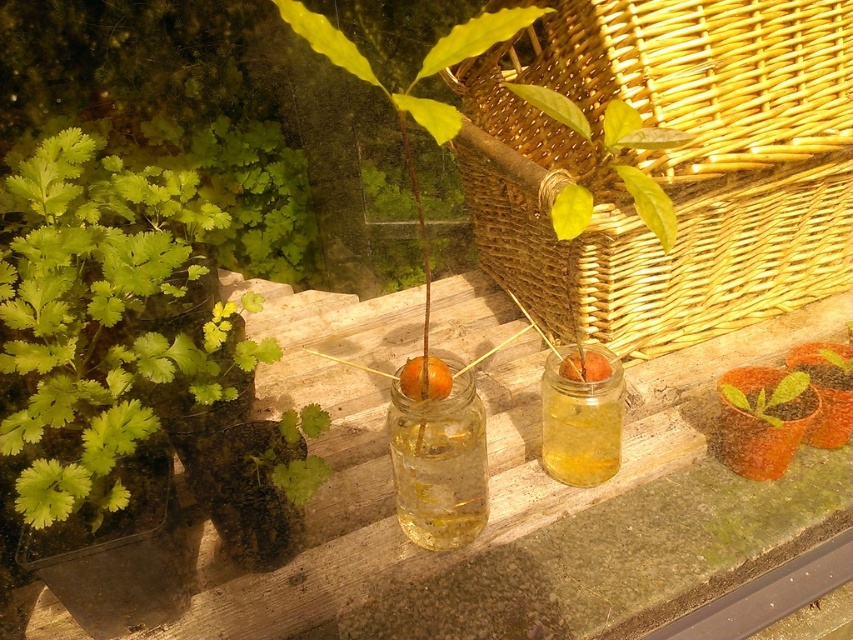
Question: Which is nearer to the translucent glass orange at center?

Choices:
 (A) translucent yellow glass jar at center
 (B) clear glass jar at center
 (C) transparent glass jars at center
 (D) woven wicker basket at upper right

Answer: (B)

Question: Can you confirm if translucent yellow glass jar at center is thinner than orange translucent at center?

Choices:
 (A) no
 (B) yes

Answer: (A)

Question: Does transparent glass jars at center lie behind orange translucent at center?

Choices:
 (A) yes
 (B) no

Answer: (B)

Question: Is transparent glass jars at center in front of green leafy plant at upper center?

Choices:
 (A) yes
 (B) no

Answer: (B)

Question: Which object is farther from the camera taking this photo?

Choices:
 (A) translucent glass orange at center
 (B) transparent glass jars at center

Answer: (B)

Question: Which point is farther to the camera?

Choices:
 (A) (402, 378)
 (B) (572, 150)
 (C) (576, 448)
 (D) (779, 396)

Answer: (B)